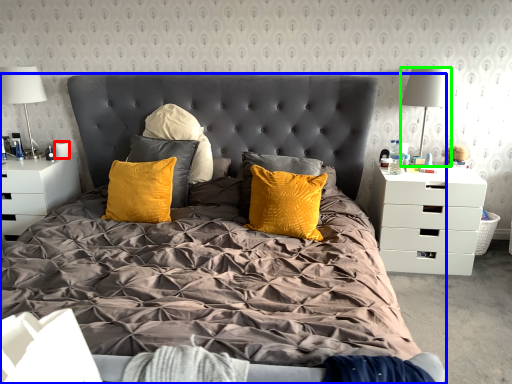
Question: Which is nearer to the coffee cup (highlighted by a red box)? bed (highlighted by a blue box) or lamp (highlighted by a green box).

Choices:
 (A) bed
 (B) lamp

Answer: (A)